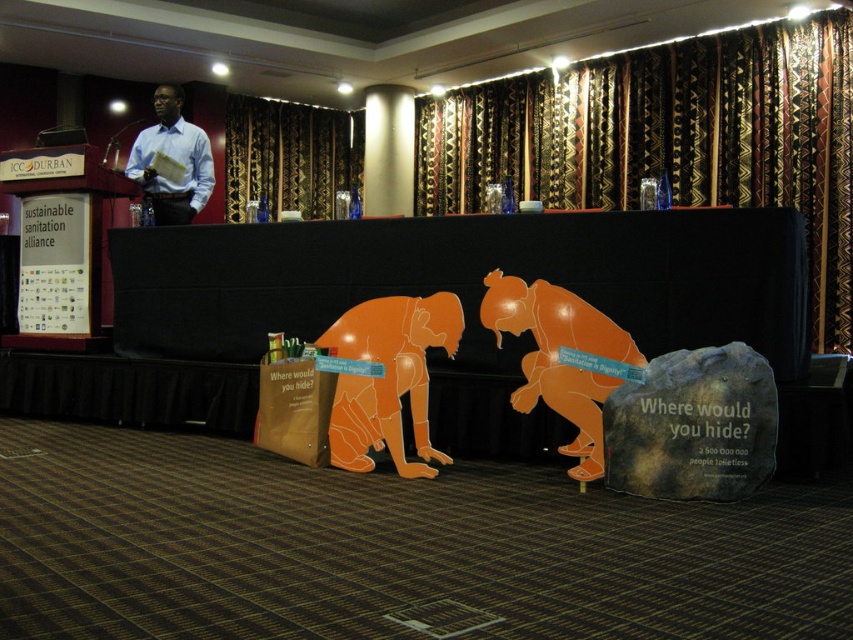
Between patterned fabric curtain at upper center and brown paper bag at lower center, which one has more height?

Standing taller between the two is patterned fabric curtain at upper center.

Who is shorter, patterned fabric curtain at upper center or brown paper bag at lower center?

brown paper bag at lower center is shorter.

This screenshot has height=640, width=853. I want to click on patterned fabric curtain at upper center, so click(x=670, y=138).

Where is `patterned fabric curtain at upper center`? The image size is (853, 640). patterned fabric curtain at upper center is located at coordinates (670, 138).

Can you confirm if patterned fabric curtain at upper center is positioned below velvet-like dark brown curtain at upper center?

Yes.

Does patterned fabric curtain at upper center have a lesser width compared to velvet-like dark brown curtain at upper center?

No.

Who is more forward, (680, 65) or (263, 134)?

Point (680, 65)

At what (x,y) coordinates should I click in order to perform the action: click on patterned fabric curtain at upper center. Please return your answer as a coordinate pair (x, y). Looking at the image, I should click on (670, 138).

Is point (289, 115) behind point (149, 176)?

Yes, point (289, 115) is farther from viewer.

What do you see at coordinates (289, 156) in the screenshot? I see `velvet-like dark brown curtain at upper center` at bounding box center [289, 156].

You are a GUI agent. You are given a task and a screenshot of the screen. Output one action in this format:
    pyautogui.click(x=<x>, y=<y>)
    Task: Click on the velvet-like dark brown curtain at upper center
    The width and height of the screenshot is (853, 640).
    Given the screenshot: What is the action you would take?
    pyautogui.click(x=289, y=156)